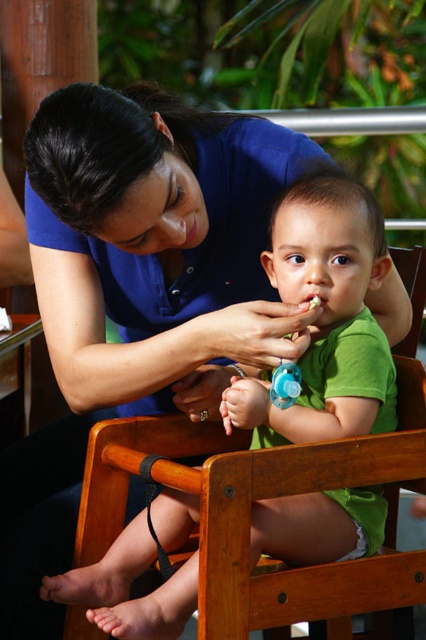
Find the location of a particular element. This screenshot has width=426, height=640. green matte shirt at center is located at coordinates (325, 317).

The image size is (426, 640). What do you see at coordinates (325, 317) in the screenshot?
I see `green matte shirt at center` at bounding box center [325, 317].

Where is `green matte shirt at center`? This screenshot has height=640, width=426. green matte shirt at center is located at coordinates (325, 317).

Which is more to the right, blue rubber sippy cup at center or blue rubber teething ring at center?

From the viewer's perspective, blue rubber sippy cup at center appears more on the right side.

The image size is (426, 640). What do you see at coordinates (284, 385) in the screenshot?
I see `blue rubber sippy cup at center` at bounding box center [284, 385].

Identify the location of blue rubber sippy cup at center. The height and width of the screenshot is (640, 426). (284, 385).

Can you confirm if green matte shirt at center is wider than blue rubber teething ring at center?

Yes, green matte shirt at center is wider than blue rubber teething ring at center.

Is green matte shirt at center further to the viewer compared to blue rubber teething ring at center?

No, green matte shirt at center is closer to the viewer.

I want to click on green matte shirt at center, so click(x=325, y=317).

The width and height of the screenshot is (426, 640). I want to click on green matte shirt at center, so click(325, 317).